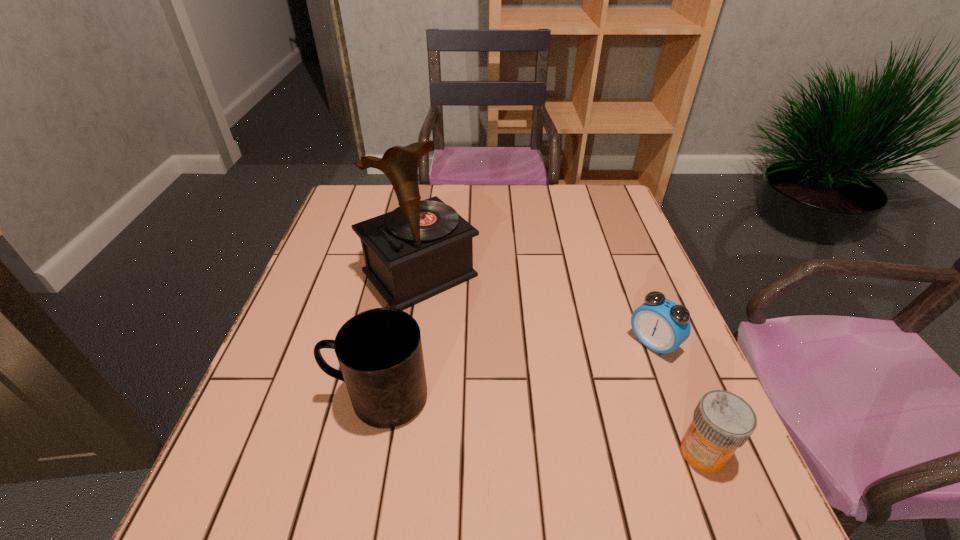
Locate an element on the screen. The image size is (960, 540). vacant area located 0.280m on the face of the alarm clock is located at coordinates (547, 435).

You are a GUI agent. You are given a task and a screenshot of the screen. Output one action in this format:
    pyautogui.click(x=<x>, y=<y>)
    Task: Click on the vacant space situated on the face of the alarm clock
    The height and width of the screenshot is (540, 960).
    Given the screenshot: What is the action you would take?
    pyautogui.click(x=528, y=451)

At what (x,y) coordinates should I click in order to perform the action: click on free space located on the face of the alarm clock. Please return your answer as a coordinate pair (x, y). The width and height of the screenshot is (960, 540). Looking at the image, I should click on (532, 448).

This screenshot has height=540, width=960. What are the coordinates of `free point located at the horn opening of the farthest object` in the screenshot? It's located at (524, 384).

Find the location of a particular element. vacant region located 0.230m at the horn opening of the farthest object is located at coordinates pos(512,372).

You are a GUI agent. You are given a task and a screenshot of the screen. Output one action in this format:
    pyautogui.click(x=<x>, y=<y>)
    Task: Click on the free spot located 0.200m at the horn opening of the farthest object
    
    Given the screenshot: What is the action you would take?
    pyautogui.click(x=503, y=362)

Image resolution: width=960 pixels, height=540 pixels. Identify the location of mug at the near edge. (379, 351).

Where is `medicine present at the near edge`? The image size is (960, 540). medicine present at the near edge is located at coordinates (722, 421).

Find the location of a particular element. The height and width of the screenshot is (540, 960). mug present at the left edge is located at coordinates (379, 351).

Identify the location of phonograph_record that is at the left edge. (422, 248).